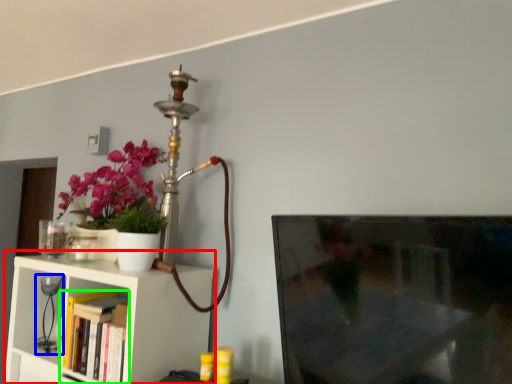
Question: Which is nearer to the shelf (highlighted by a red box)? table lamp (highlighted by a blue box) or book (highlighted by a green box).

Choices:
 (A) table lamp
 (B) book

Answer: (B)